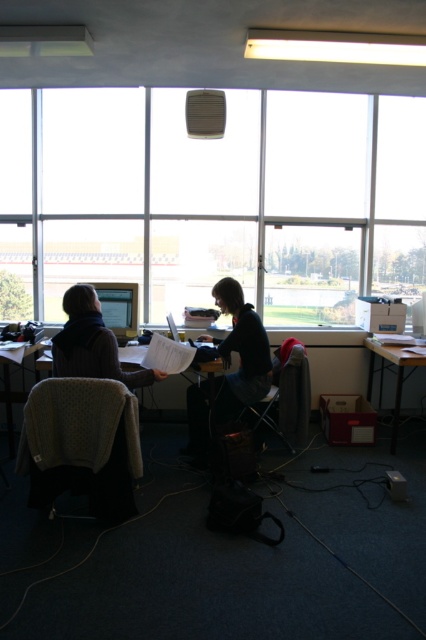
Question: Is matte black computer desk at lower right above wooden table at lower left?

Choices:
 (A) no
 (B) yes

Answer: (B)

Question: Which point is closer to the camera?

Choices:
 (A) metallic gray chair at center
 (B) dark gray fabric jacket at center
 (C) wooden table at lower left
 (D) matte black monitor at left

Answer: (D)

Question: From the image, what is the correct spatial relationship of knitted fabric swivel chair at left in relation to dark gray fabric jacket at center?

Choices:
 (A) left
 (B) right

Answer: (A)

Question: Which object appears farthest from the camera in this image?

Choices:
 (A) white plastic table at center
 (B) dark gray fabric jacket at center
 (C) transparent glass window at center

Answer: (C)

Question: Does transparent glass window at center lie in front of matte black monitor at left?

Choices:
 (A) yes
 (B) no

Answer: (B)

Question: Among these points, which one is farthest from the camera?

Choices:
 (A) (6, 422)
 (B) (135, 364)
 (C) (291, 381)
 (D) (420, 172)

Answer: (D)